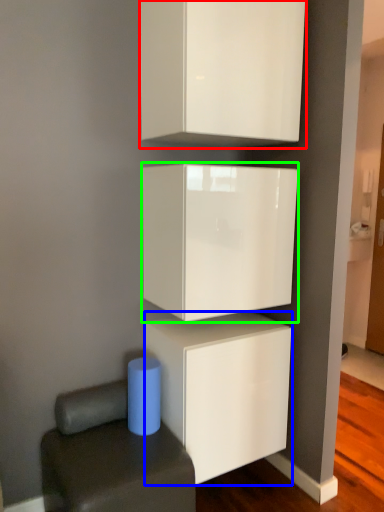
Question: Considering the real-world distances, which object is farthest from cabinetry (highlighted by a red box)? cabinetry (highlighted by a blue box) or cabinetry (highlighted by a green box)?

Choices:
 (A) cabinetry
 (B) cabinetry

Answer: (A)